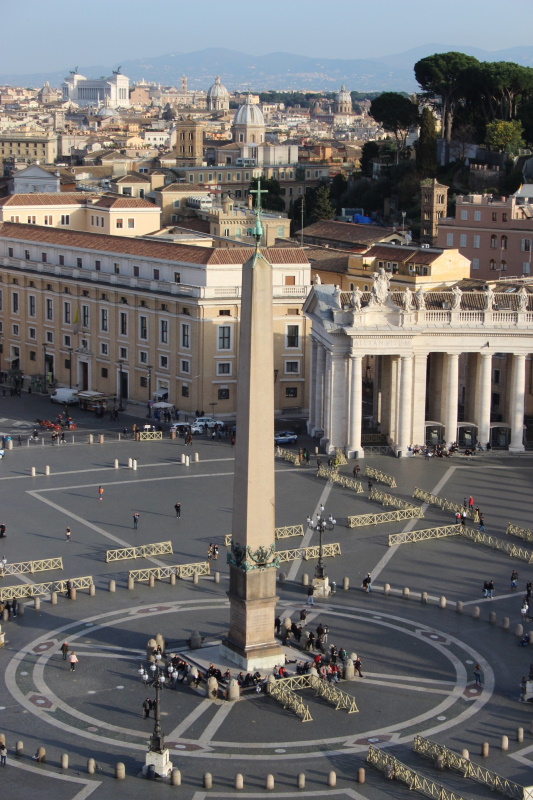
The image size is (533, 800). I want to click on gray concrete smooth ground, so click(x=183, y=529).